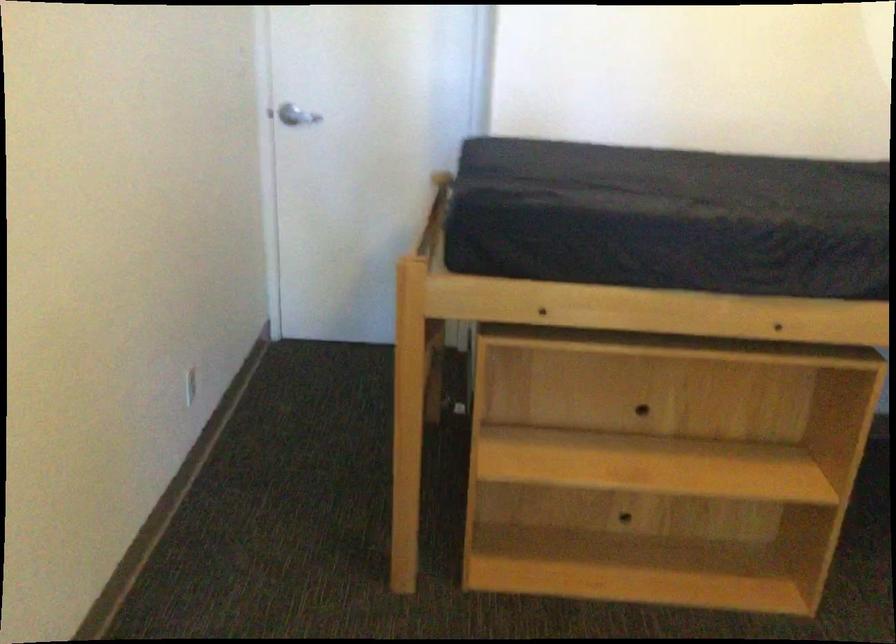
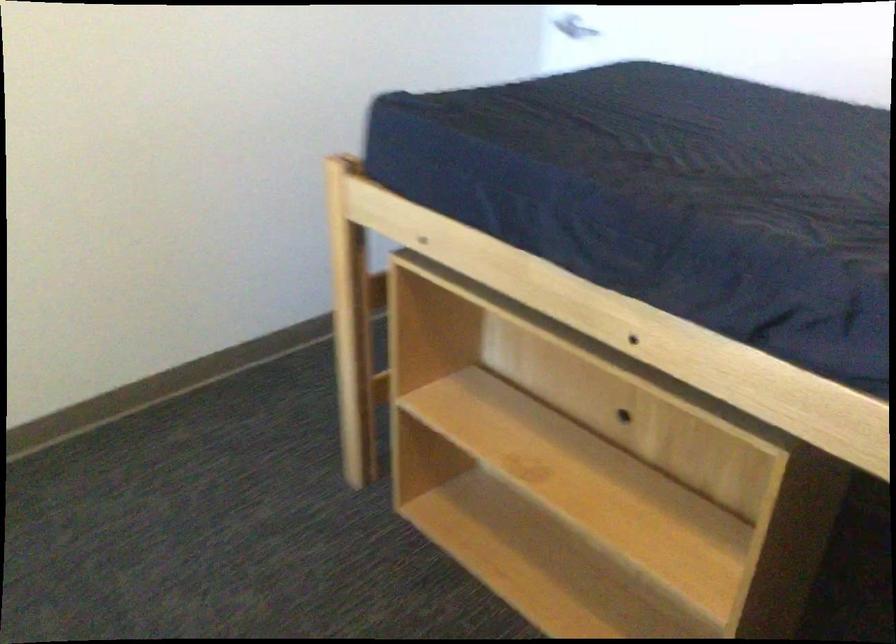
In the second image, find the point that corresponds to point 488,296 in the first image.

(392, 214)